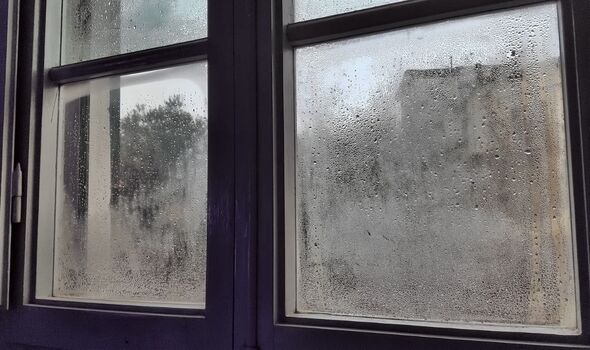
Locate an element on the screen. Image resolution: width=590 pixels, height=350 pixels. window borders is located at coordinates (81, 328), (324, 26), (98, 62).